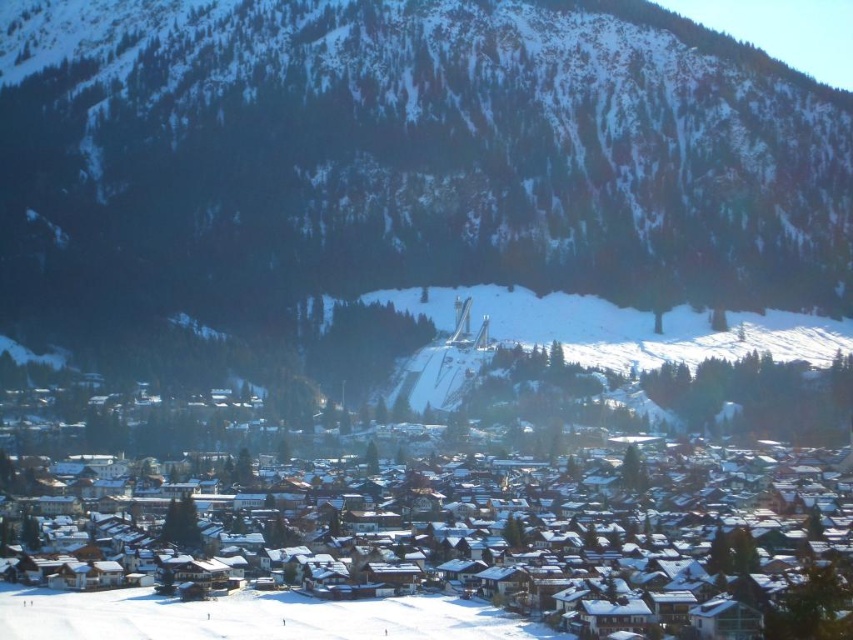
Question: Which of the following is the closest to the observer?

Choices:
 (A) 552,566
 (B) 19,236

Answer: (A)

Question: Is snowy forested mountain at center to the right of white snow-covered houses at center from the viewer's perspective?

Choices:
 (A) yes
 (B) no

Answer: (B)

Question: Does snowy forested mountain at center have a lesser width compared to white snow-covered houses at center?

Choices:
 (A) yes
 (B) no

Answer: (B)

Question: Which object appears farthest from the camera in this image?

Choices:
 (A) snowy forested mountain at center
 (B) white snow-covered houses at center

Answer: (A)

Question: Does snowy forested mountain at center appear over white snow-covered houses at center?

Choices:
 (A) yes
 (B) no

Answer: (A)